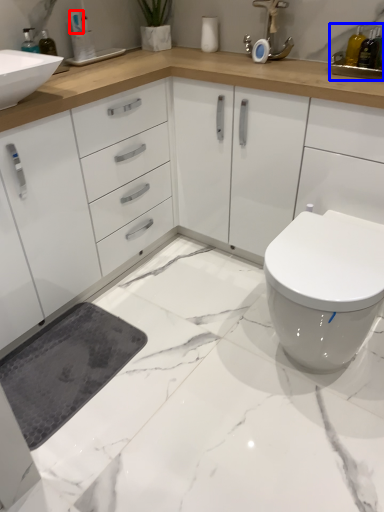
Question: Which object appears farthest to the camera in this image, toiletry (highlighted by a red box) or sink (highlighted by a blue box)?

Choices:
 (A) toiletry
 (B) sink

Answer: (A)